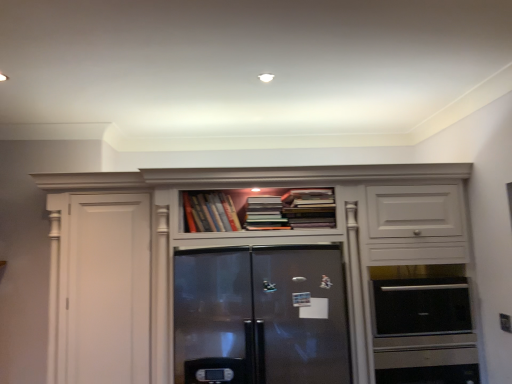
Question: Is satin black oven at right positioned in front of hardcover books at center, acting as the first book starting from the left?

Choices:
 (A) yes
 (B) no

Answer: (A)

Question: Is satin black oven at right positioned beyond the bounds of hardcover books at center, acting as the first book starting from the left?

Choices:
 (A) no
 (B) yes

Answer: (B)

Question: Can you confirm if satin black oven at right is thinner than hardcover books at center, acting as the first book starting from the left?

Choices:
 (A) no
 (B) yes

Answer: (A)

Question: Considering the relative sizes of satin black oven at right and hardcover books at center, acting as the first book starting from the left, in the image provided, is satin black oven at right bigger than hardcover books at center, acting as the first book starting from the left,?

Choices:
 (A) yes
 (B) no

Answer: (A)

Question: From the image's perspective, is satin black oven at right located above hardcover books at center, acting as the first book starting from the left?

Choices:
 (A) yes
 (B) no

Answer: (B)

Question: Does satin black oven at right turn towards hardcover books at center, acting as the first book starting from the left?

Choices:
 (A) no
 (B) yes

Answer: (A)

Question: From a real-world perspective, is satin black oven at right located higher than matte white cabinet at center?

Choices:
 (A) yes
 (B) no

Answer: (B)

Question: From a real-world perspective, is satin black oven at right under matte white cabinet at center?

Choices:
 (A) no
 (B) yes

Answer: (B)

Question: Would you say satin black oven at right is outside matte white cabinet at center?

Choices:
 (A) no
 (B) yes

Answer: (A)

Question: Does satin black oven at right have a larger size compared to matte white cabinet at center?

Choices:
 (A) yes
 (B) no

Answer: (B)

Question: From the image's perspective, is satin black oven at right located above matte white cabinet at center?

Choices:
 (A) no
 (B) yes

Answer: (A)

Question: Is satin black oven at right facing towards matte white cabinet at center?

Choices:
 (A) yes
 (B) no

Answer: (A)

Question: Is hardcover books at center, acting as the first book starting from the left, completely or partially outside of hardcover books at upper center, marked as the 3th book in a left-to-right arrangement?

Choices:
 (A) yes
 (B) no

Answer: (A)